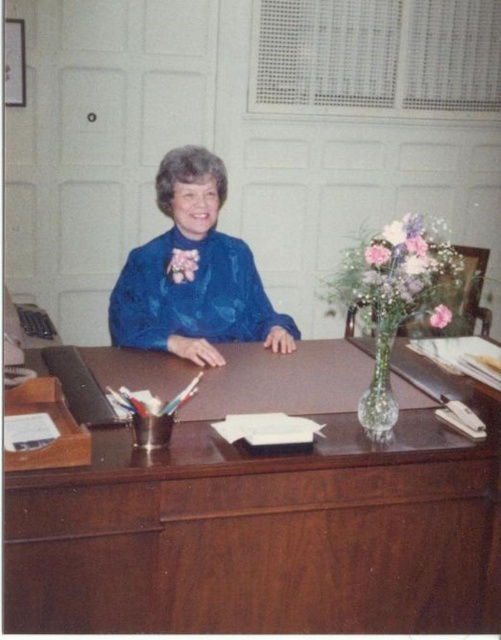
Question: Does brown wood table at center lie in front of pink matte flower at center?

Choices:
 (A) no
 (B) yes

Answer: (B)

Question: Where is pink silk flower at center located in relation to pink matte flower at center in the image?

Choices:
 (A) left
 (B) right

Answer: (A)

Question: Can you confirm if translucent glass vase at center is bigger than pink matte flower at center?

Choices:
 (A) no
 (B) yes

Answer: (B)

Question: Which of the following is the closest to the observer?

Choices:
 (A) (450, 314)
 (B) (180, 257)
 (C) (386, 458)

Answer: (C)

Question: Estimate the real-world distances between objects in this image. Which object is closer to the pink silk flower at center?

Choices:
 (A) pink matte flower at center
 (B) blue satin blouse at center
 (C) brown wood table at center

Answer: (B)

Question: Which point is closer to the camera taking this photo?

Choices:
 (A) (385, 256)
 (B) (440, 308)

Answer: (A)